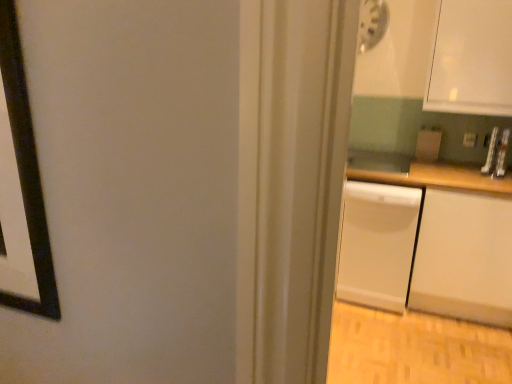
What do you see at coordinates (377, 244) in the screenshot? Image resolution: width=512 pixels, height=384 pixels. I see `white matte dishwasher at right` at bounding box center [377, 244].

The image size is (512, 384). In order to click on white matte dishwasher at right in this screenshot , I will do `click(377, 244)`.

Where is `white matte dishwasher at right`? The image size is (512, 384). white matte dishwasher at right is located at coordinates (377, 244).

The width and height of the screenshot is (512, 384). Find the location of `dish washer on the left of matte white dishwasher at right`. dish washer on the left of matte white dishwasher at right is located at coordinates (377, 244).

From the image's perspective, relative to white matte dishwasher at right, is matte white dishwasher at right above or below?

matte white dishwasher at right is situated higher than white matte dishwasher at right in the image.

Looking at their sizes, would you say matte white dishwasher at right is wider or thinner than white matte dishwasher at right?

Considering their sizes, matte white dishwasher at right looks slimmer than white matte dishwasher at right.

Can you tell me how much matte white dishwasher at right and white matte dishwasher at right differ in facing direction?

The angle between the facing direction of matte white dishwasher at right and the facing direction of white matte dishwasher at right is 0.935 degrees.

Could white matte counter at right be considered to be inside white matte dishwasher at right?

Absolutely, white matte counter at right is inside white matte dishwasher at right.

From the image's perspective, which one is positioned lower, white matte dishwasher at right or white matte counter at right?

From the image's view, white matte dishwasher at right is below.

Considering the sizes of objects white matte dishwasher at right and white matte counter at right in the image provided, who is wider, white matte dishwasher at right or white matte counter at right?

white matte dishwasher at right.

Is white matte dishwasher at right placed right next to white matte counter at right?

No.

Can you confirm if matte white dishwasher at right is positioned to the left of white matte counter at right?

No, matte white dishwasher at right is not to the left of white matte counter at right.

Would you say white matte counter at right is part of matte white dishwasher at right's contents?

No, matte white dishwasher at right does not contain white matte counter at right.

Is matte white dishwasher at right oriented towards white matte counter at right?

No, matte white dishwasher at right is not facing towards white matte counter at right.

From a real-world perspective, is matte white dishwasher at right over white matte counter at right?

Yes.

Find the location of a particular element. counter below the matte white dishwasher at right (from the image's perspective) is located at coordinates (426, 239).

Are white matte counter at right and matte white dishwasher at right beside each other?

No.

Considering the relative sizes of white matte counter at right and matte white dishwasher at right in the image provided, is white matte counter at right shorter than matte white dishwasher at right?

No, white matte counter at right is not shorter than matte white dishwasher at right.

Can you confirm if white matte counter at right is positioned to the right of matte white dishwasher at right?

No, white matte counter at right is not to the right of matte white dishwasher at right.

Which is correct: white matte dishwasher at right is inside matte white dishwasher at right, or outside of it?

white matte dishwasher at right cannot be found inside matte white dishwasher at right.

Who is taller, white matte dishwasher at right or matte white dishwasher at right?

With more height is white matte dishwasher at right.

Can you tell me how much white matte dishwasher at right and matte white dishwasher at right differ in facing direction?

There is a 0.935-degree angle between the facing directions of white matte dishwasher at right and matte white dishwasher at right.

Looking at this image, from a real-world perspective, does white matte dishwasher at right stand above matte white dishwasher at right?

Actually, white matte dishwasher at right is physically below matte white dishwasher at right in the real world.

Is white matte counter at right closer to camera compared to white matte dishwasher at right?

Yes, white matte counter at right is closer to the viewer.

Is white matte counter at right far away from white matte dishwasher at right?

No, there isn't a large distance between white matte counter at right and white matte dishwasher at right.

How many degrees apart are the facing directions of white matte counter at right and white matte dishwasher at right?

There is a 0.56-degree angle between the facing directions of white matte counter at right and white matte dishwasher at right.

From the image's perspective, is white matte counter at right on top of white matte dishwasher at right?

Correct, white matte counter at right appears higher than white matte dishwasher at right in the image.

Identify the location of dish washer that is on the left side of matte white dishwasher at right. The height and width of the screenshot is (384, 512). (377, 244).

At what (x,y) coordinates should I click in order to perform the action: click on counter above the white matte dishwasher at right (from the image's perspective). Please return your answer as a coordinate pair (x, y). Looking at the image, I should click on (426, 239).

When comparing their distances from matte white dishwasher at right, does white matte counter at right or white matte dishwasher at right seem closer?

white matte counter at right.

When comparing their distances from white matte dishwasher at right, does matte white dishwasher at right or white matte counter at right seem closer?

Among the two, white matte counter at right is located nearer to white matte dishwasher at right.

Based on their spatial positions, is white matte counter at right or matte white dishwasher at right closer to white matte dishwasher at right?

The object closer to white matte dishwasher at right is white matte counter at right.

When comparing their distances from white matte counter at right, does white matte dishwasher at right or matte white dishwasher at right seem closer?

white matte dishwasher at right is closer to white matte counter at right.

When comparing their distances from matte white dishwasher at right, does white matte dishwasher at right or white matte counter at right seem further?

Based on the image, white matte dishwasher at right appears to be further to matte white dishwasher at right.

Based on their spatial positions, is matte white dishwasher at right or white matte dishwasher at right closer to white matte counter at right?

Among the two, white matte dishwasher at right is located nearer to white matte counter at right.

You are a GUI agent. You are given a task and a screenshot of the screen. Output one action in this format:
    pyautogui.click(x=<x>, y=<y>)
    Task: Click on the counter between matte white dishwasher at right and white matte dishwasher at right vertically
    This screenshot has width=512, height=384.
    Given the screenshot: What is the action you would take?
    pyautogui.click(x=426, y=239)